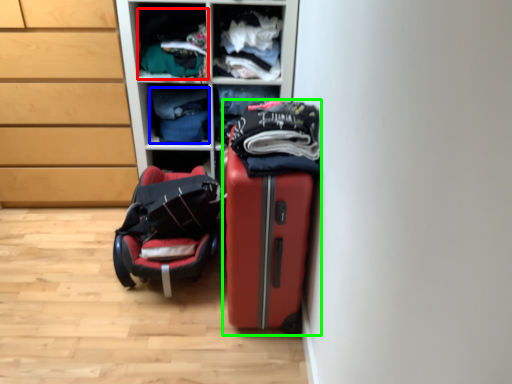
Question: Considering the real-world distances, which object is farthest from clothing (highlighted by a red box)? clothing (highlighted by a blue box) or suitcase (highlighted by a green box)?

Choices:
 (A) clothing
 (B) suitcase

Answer: (B)